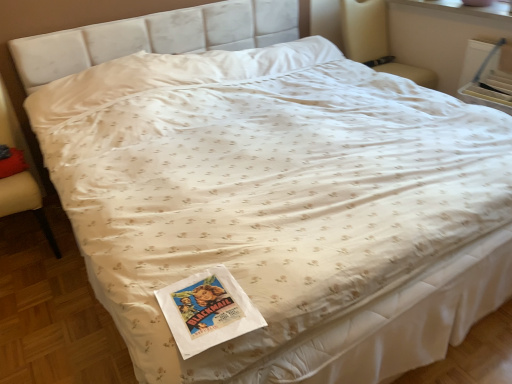
What do you see at coordinates (365, 30) in the screenshot? I see `beige fabric armchair at upper right, the first armchair positioned from the right` at bounding box center [365, 30].

Describe the element at coordinates (25, 202) in the screenshot. Image resolution: width=512 pixels, height=384 pixels. I see `velvet beige armchair at left, the first armchair when ordered from bottom to top` at that location.

Locate an element on the screen. The image size is (512, 384). beige fabric armchair at upper right, which is the 2th armchair from left to right is located at coordinates (365, 30).

Is beige fabric armchair at upper right, marked as the 1th armchair in a back-to-front arrangement, facing towards velvet beige armchair at left, the first armchair when ordered from bottom to top?

No.

Considering the relative positions of beige fabric armchair at upper right, marked as the 2th armchair in a front-to-back arrangement, and velvet beige armchair at left, placed as the 1th armchair when sorted from front to back, in the image provided, is beige fabric armchair at upper right, marked as the 2th armchair in a front-to-back arrangement, behind velvet beige armchair at left, placed as the 1th armchair when sorted from front to back,?

Yes, beige fabric armchair at upper right, marked as the 2th armchair in a front-to-back arrangement, is further from the camera.

Considering the positions of objects beige fabric armchair at upper right, the first armchair from the top, and velvet beige armchair at left, placed as the 1th armchair when sorted from front to back, in the image provided, who is more to the left, beige fabric armchair at upper right, the first armchair from the top, or velvet beige armchair at left, placed as the 1th armchair when sorted from front to back,?

Positioned to the left is velvet beige armchair at left, placed as the 1th armchair when sorted from front to back.

From a real-world perspective, is beige fabric armchair at upper right, the first armchair positioned from the right, on top of velvet beige armchair at left, the first armchair from the left?

Correct, in the physical world, beige fabric armchair at upper right, the first armchair positioned from the right, is higher than velvet beige armchair at left, the first armchair from the left.

Who is bigger, beige fabric armchair at upper right, the first armchair positioned from the right, or red cotton pillow at lower left?

beige fabric armchair at upper right, the first armchair positioned from the right, is bigger.

From a real-world perspective, which object stands above the other?

beige fabric armchair at upper right, the 2th armchair in the bottom-to-top sequence, from a real-world perspective.

The height and width of the screenshot is (384, 512). I want to click on armchair behind the red cotton pillow at lower left, so click(x=365, y=30).

Relative to red cotton pillow at lower left, is beige fabric armchair at upper right, marked as the 1th armchair in a back-to-front arrangement, in front or behind?

beige fabric armchair at upper right, marked as the 1th armchair in a back-to-front arrangement, is positioned farther from the viewer than red cotton pillow at lower left.

Does velvet beige armchair at left, arranged as the 2th armchair when viewed from the top, have a greater width compared to beige fabric armchair at upper right, which is the 2th armchair from left to right?

In fact, velvet beige armchair at left, arranged as the 2th armchair when viewed from the top, might be narrower than beige fabric armchair at upper right, which is the 2th armchair from left to right.

From the image's perspective, is velvet beige armchair at left, marked as the second armchair in a back-to-front arrangement, located above beige fabric armchair at upper right, marked as the 2th armchair in a front-to-back arrangement?

Actually, velvet beige armchair at left, marked as the second armchair in a back-to-front arrangement, appears below beige fabric armchair at upper right, marked as the 2th armchair in a front-to-back arrangement, in the image.

Which is closer to the camera, (22, 208) or (356, 38)?

The point (22, 208) is in front.

Looking at this image, which of these two, velvet beige armchair at left, the first armchair from the left, or red cotton pillow at lower left, is wider?

Wider between the two is velvet beige armchair at left, the first armchair from the left.

Is point (13, 146) closer or farther from the camera than point (13, 164)?

Point (13, 146) is farther from the camera than point (13, 164).

From a real-world perspective, which is physically above, velvet beige armchair at left, the first armchair from the left, or red cotton pillow at lower left?

From a 3D spatial view, red cotton pillow at lower left is above.

How different are the orientations of red cotton pillow at lower left and beige fabric armchair at upper right, the first armchair from the top, in degrees?

1.34 degrees separate the facing orientations of red cotton pillow at lower left and beige fabric armchair at upper right, the first armchair from the top.

Locate an element on the screen. This screenshot has height=384, width=512. armchair located on the right of red cotton pillow at lower left is located at coordinates (365, 30).

From their relative heights in the image, would you say red cotton pillow at lower left is taller or shorter than beige fabric armchair at upper right, which is the 2th armchair from left to right?

red cotton pillow at lower left is shorter than beige fabric armchair at upper right, which is the 2th armchair from left to right.

Can beige fabric armchair at upper right, marked as the 2th armchair in a front-to-back arrangement, be found inside red cotton pillow at lower left?

No, beige fabric armchair at upper right, marked as the 2th armchair in a front-to-back arrangement, is not inside red cotton pillow at lower left.

This screenshot has height=384, width=512. Identify the location of pillow that is behind the velvet beige armchair at left, the first armchair when ordered from bottom to top. (11, 161).

From the picture: Is red cotton pillow at lower left in front of or behind velvet beige armchair at left, the first armchair from the left, in the image?

In the image, red cotton pillow at lower left appears behind velvet beige armchair at left, the first armchair from the left.

Is red cotton pillow at lower left wider than velvet beige armchair at left, arranged as the 2th armchair when viewed from the top?

Incorrect, the width of red cotton pillow at lower left does not surpass that of velvet beige armchair at left, arranged as the 2th armchair when viewed from the top.

At what (x,y) coordinates should I click in order to perform the action: click on armchair on the left of beige fabric armchair at upper right, the 2th armchair in the bottom-to-top sequence. Please return your answer as a coordinate pair (x, y). Looking at the image, I should click on point(25,202).

You are a GUI agent. You are given a task and a screenshot of the screen. Output one action in this format:
    pyautogui.click(x=<x>, y=<y>)
    Task: Click on the pillow that is below the beige fabric armchair at upper right, the first armchair positioned from the right (from the image's perspective)
    The height and width of the screenshot is (384, 512).
    Given the screenshot: What is the action you would take?
    pyautogui.click(x=11, y=161)

Estimate the real-world distances between objects in this image. Which object is further from red cotton pillow at lower left, beige fabric armchair at upper right, the 2th armchair in the bottom-to-top sequence, or velvet beige armchair at left, the first armchair when ordered from bottom to top?

beige fabric armchair at upper right, the 2th armchair in the bottom-to-top sequence, is further to red cotton pillow at lower left.

Looking at the image, which one is located closer to red cotton pillow at lower left, velvet beige armchair at left, marked as the second armchair in a back-to-front arrangement, or beige fabric armchair at upper right, the first armchair from the top?

velvet beige armchair at left, marked as the second armchair in a back-to-front arrangement, is closer to red cotton pillow at lower left.

Estimate the real-world distances between objects in this image. Which object is further from beige fabric armchair at upper right, the 2th armchair in the bottom-to-top sequence, velvet beige armchair at left, placed as the 1th armchair when sorted from front to back, or red cotton pillow at lower left?

Based on the image, red cotton pillow at lower left appears to be further to beige fabric armchair at upper right, the 2th armchair in the bottom-to-top sequence.

Estimate the real-world distances between objects in this image. Which object is closer to beige fabric armchair at upper right, the first armchair from the top, red cotton pillow at lower left or velvet beige armchair at left, placed as the 1th armchair when sorted from front to back?

The object closer to beige fabric armchair at upper right, the first armchair from the top, is velvet beige armchair at left, placed as the 1th armchair when sorted from front to back.

Looking at the image, which one is located closer to velvet beige armchair at left, positioned as the second armchair in right-to-left order, beige fabric armchair at upper right, the first armchair from the top, or red cotton pillow at lower left?

The object closer to velvet beige armchair at left, positioned as the second armchair in right-to-left order, is red cotton pillow at lower left.

Based on their spatial positions, is red cotton pillow at lower left or beige fabric armchair at upper right, which is the 2th armchair from left to right, closer to velvet beige armchair at left, the first armchair when ordered from bottom to top?

The object closer to velvet beige armchair at left, the first armchair when ordered from bottom to top, is red cotton pillow at lower left.

Where is `pillow between velvet beige armchair at left, positioned as the second armchair in right-to-left order, and beige fabric armchair at upper right, the 2th armchair in the bottom-to-top sequence, from left to right`? This screenshot has width=512, height=384. pillow between velvet beige armchair at left, positioned as the second armchair in right-to-left order, and beige fabric armchair at upper right, the 2th armchair in the bottom-to-top sequence, from left to right is located at coordinates (11, 161).